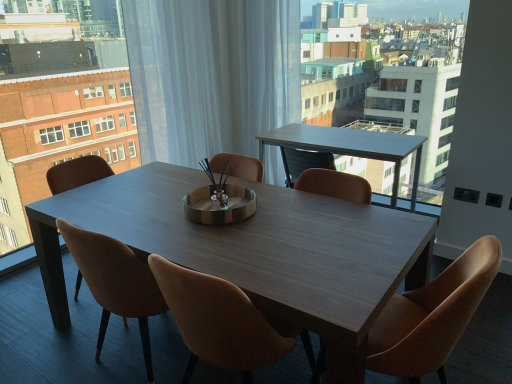
Question: Does point (229, 334) appear closer or farther from the camera than point (442, 279)?

Choices:
 (A) closer
 (B) farther

Answer: (A)

Question: Is brown leather chair at center, marked as the second chair in a right-to-left arrangement, to the left or to the right of leather at center, placed as the 1th chair when sorted from right to left, in the image?

Choices:
 (A) left
 (B) right

Answer: (A)

Question: Considering the real-world distances, which object is closest to the leather at center, placed as the 1th chair when sorted from right to left?

Choices:
 (A) wooden table at center
 (B) brown leather chair at center, which is counted as the 2th chair, starting from the left
 (C) brown leather chair at center, the 3th chair positioned from the right
 (D) matte wood table at center, which appears as the 2th condominium when viewed from the right
 (E) light brown wooden table at upper center

Answer: (A)

Question: Which is nearer to the smooth white table at upper right, the second condominium when ordered from left to right?

Choices:
 (A) brown leather chair at center, the 3th chair positioned from the right
 (B) light brown wooden table at upper center
 (C) leather at center, placed as the 1th chair when sorted from right to left
 (D) matte wood table at center, which appears as the 2th condominium when viewed from the right
 (E) brown leather chair at center, which is counted as the 2th chair, starting from the left

Answer: (B)